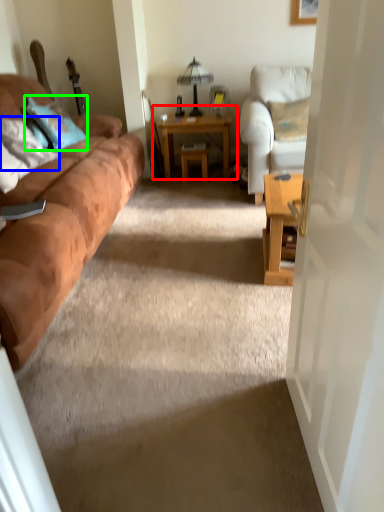
Question: Which is nearer to the table (highlighted by a red box)? pillow (highlighted by a blue box) or pillow (highlighted by a green box).

Choices:
 (A) pillow
 (B) pillow

Answer: (B)